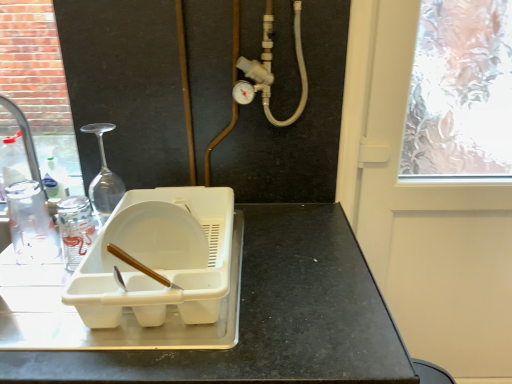
Question: From the image's perspective, is white plastic tray at center above clear plastic bottle at left?

Choices:
 (A) yes
 (B) no

Answer: (B)

Question: Is white plastic tray at center looking in the opposite direction of clear plastic bottle at left?

Choices:
 (A) yes
 (B) no

Answer: (B)

Question: Would you say white plastic tray at center is a long distance from clear plastic bottle at left?

Choices:
 (A) yes
 (B) no

Answer: (B)

Question: Is white plastic tray at center positioned beyond the bounds of clear plastic bottle at left?

Choices:
 (A) no
 (B) yes

Answer: (B)

Question: Is white plastic tray at center further to camera compared to clear plastic bottle at left?

Choices:
 (A) yes
 (B) no

Answer: (B)

Question: Is white plastic tray at center bigger or smaller than white plastic dish rack at center?

Choices:
 (A) big
 (B) small

Answer: (A)

Question: Is white plastic tray at center taller or shorter than white plastic dish rack at center?

Choices:
 (A) tall
 (B) short

Answer: (A)

Question: Is white plastic tray at center wider or thinner than white plastic dish rack at center?

Choices:
 (A) wide
 (B) thin

Answer: (A)

Question: Does point (289, 241) appear closer or farther from the camera than point (143, 253)?

Choices:
 (A) closer
 (B) farther

Answer: (B)

Question: Relative to brushed metal faucet at left, is clear plastic bottle at left in front or behind?

Choices:
 (A) front
 (B) behind

Answer: (A)

Question: Considering the positions of clear plastic bottle at left and brushed metal faucet at left in the image, is clear plastic bottle at left taller or shorter than brushed metal faucet at left?

Choices:
 (A) short
 (B) tall

Answer: (A)

Question: Looking at the image, does clear plastic bottle at left seem bigger or smaller compared to brushed metal faucet at left?

Choices:
 (A) big
 (B) small

Answer: (B)

Question: Looking at their shapes, would you say clear plastic bottle at left is wider or thinner than brushed metal faucet at left?

Choices:
 (A) thin
 (B) wide

Answer: (B)

Question: In the image, is white plastic dish rack at center on the left side or the right side of transparent frosted glass screen door at upper right?

Choices:
 (A) left
 (B) right

Answer: (A)

Question: From a real-world perspective, is white plastic dish rack at center positioned above or below transparent frosted glass screen door at upper right?

Choices:
 (A) above
 (B) below

Answer: (A)